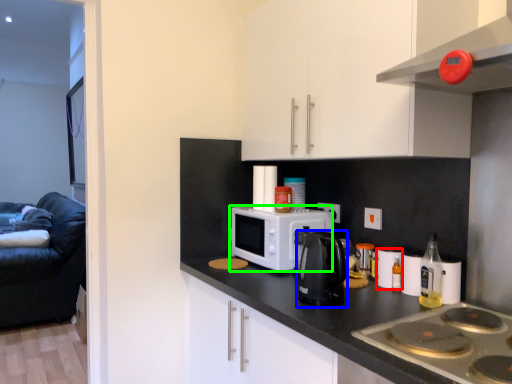
Question: Which object is positioned farthest from appliance (highlighted by a red box)? Select from kitchen appliance (highlighted by a blue box) and microwave oven (highlighted by a green box).

Choices:
 (A) kitchen appliance
 (B) microwave oven

Answer: (B)